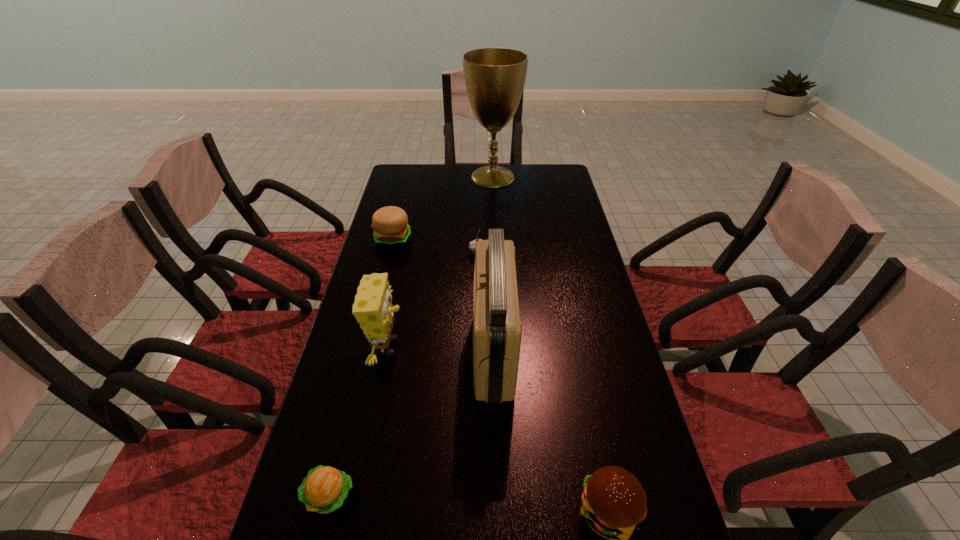
Find the location of a particular element. This screenshot has width=960, height=540. vacant space located 0.260m on the front-facing side of the radio receiver is located at coordinates (376, 352).

You are a GUI agent. You are given a task and a screenshot of the screen. Output one action in this format:
    pyautogui.click(x=<x>, y=<y>)
    Task: Click on the vacant space situated 0.140m on the face of the third tallest object
    
    Given the screenshot: What is the action you would take?
    pyautogui.click(x=458, y=348)

Locate an element on the screen. This screenshot has height=540, width=960. free location located 0.400m on the front of the farthest hamburger is located at coordinates click(x=368, y=339).

Where is `vacant area located 0.150m on the right of the cupcake`? This screenshot has width=960, height=540. vacant area located 0.150m on the right of the cupcake is located at coordinates (532, 253).

The image size is (960, 540). What are the coordinates of `vacant area situated 0.280m on the back of the shortest object` in the screenshot? It's located at (362, 366).

I want to click on object present at the far edge, so (494, 78).

Where is `sponge that is positioned at the left edge`? The width and height of the screenshot is (960, 540). sponge that is positioned at the left edge is located at coordinates (372, 308).

In order to click on vacant position at the left edge of the desktop in this screenshot , I will do `click(363, 401)`.

This screenshot has width=960, height=540. I want to click on vacant space at the right edge, so click(560, 225).

Where is `vacant space at the far left corner of the desktop`? vacant space at the far left corner of the desktop is located at coordinates (409, 182).